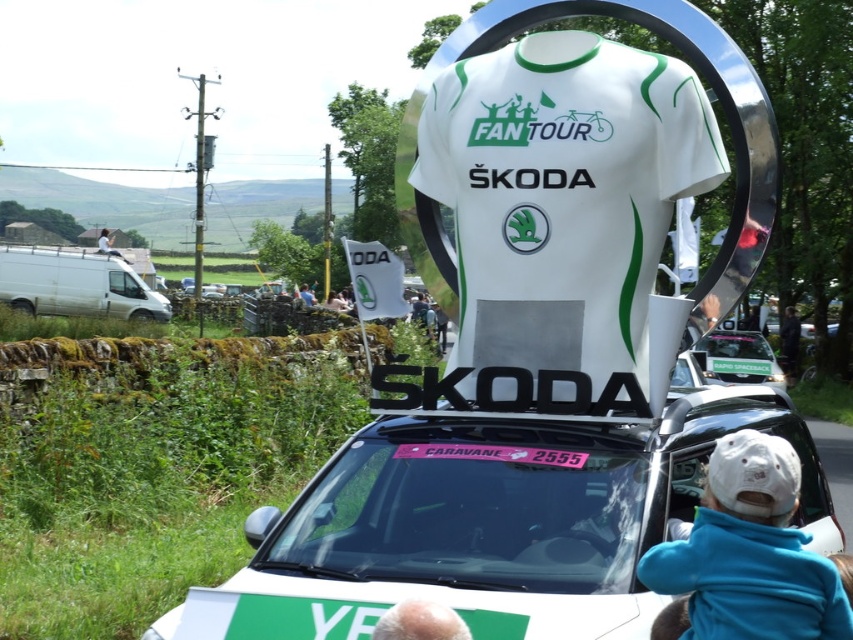
Is white fabric shirt at center wider than white fleece jacket at lower right?

Indeed, white fabric shirt at center has a greater width compared to white fleece jacket at lower right.

Image resolution: width=853 pixels, height=640 pixels. Describe the element at coordinates (564, 196) in the screenshot. I see `white fabric shirt at center` at that location.

What are the coordinates of `white fabric shirt at center` in the screenshot? It's located at (564, 196).

Is white fleece jacket at lower right closer to the viewer compared to smooth skin head at center?

That is False.

Identify the location of white fleece jacket at lower right. This screenshot has height=640, width=853. (x=750, y=552).

The image size is (853, 640). Find the location of `white fleece jacket at lower right`. white fleece jacket at lower right is located at coordinates (750, 552).

Based on the photo, between white fleece jacket at lower right and white glossy sign at center, which one appears on the left side from the viewer's perspective?

From the viewer's perspective, white fleece jacket at lower right appears more on the left side.

Between white fleece jacket at lower right and white glossy sign at center, which one is positioned lower?

white fleece jacket at lower right is lower down.

Between point (641, 573) and point (764, 349), which one is positioned behind?

Positioned behind is point (764, 349).

Identify the location of white fleece jacket at lower right. The image size is (853, 640). (750, 552).